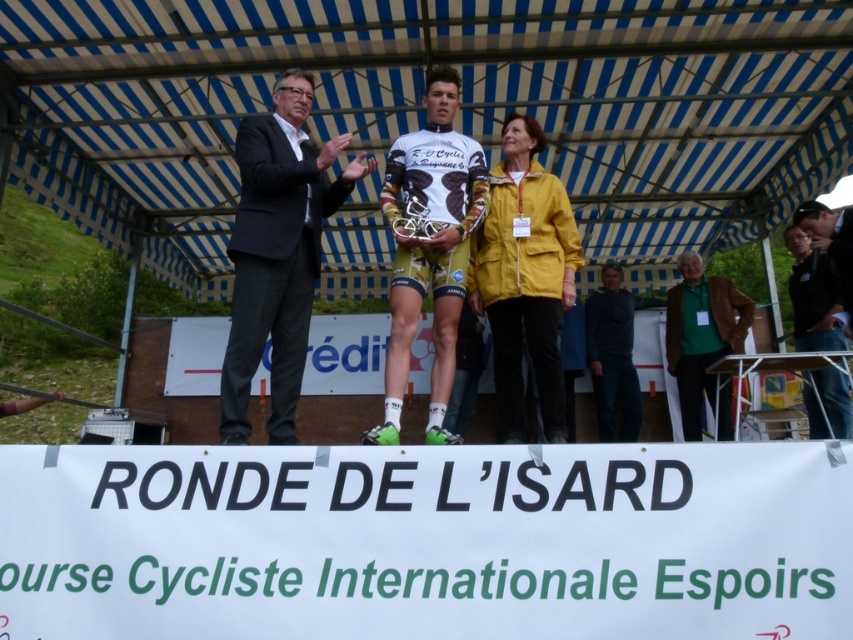
You are a photographer at the Ronde de l Isard event and need to take a photo of the cyclist holding the trophy. The photographer is standing at point 0.5, 0.5. Where should you position yourself to include both the cyclist and the dark gray suit at left in the frame?

To include both the cyclist and the dark gray suit at left in the frame, position yourself so that the dark gray suit at left is on the left side of the photo. Since the dark gray suit at left is located at point (277, 252) and the photographer is at (426, 320), moving slightly to the right would center the composition while keeping both subjects within the frame.

You are standing at the event and want to take a photo of the two points mentioned. Which point, point (229,342) or point (573,260), is closer to you?

Point (229,342) is closer to the viewer than point (573,260).